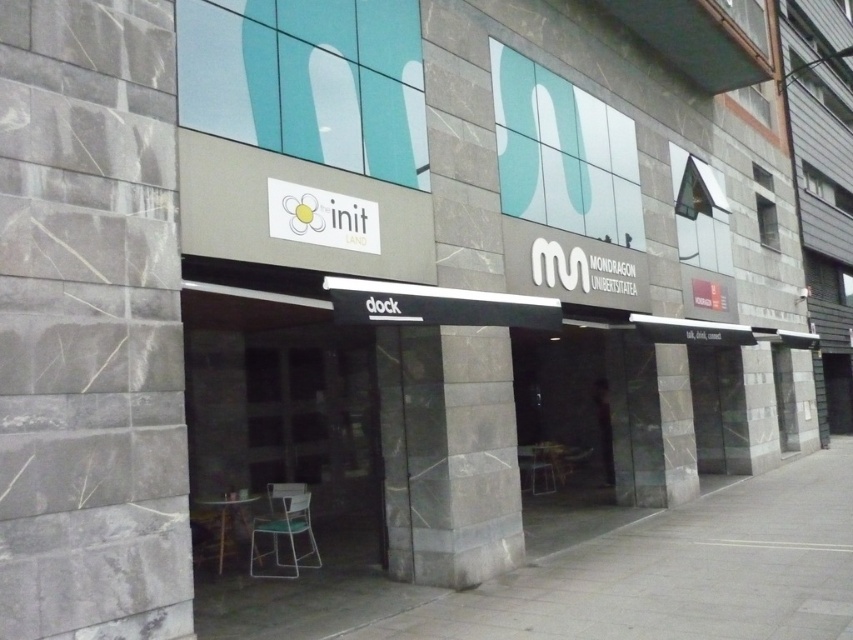
You are standing in front of the modern building with the init LAND sign. You need to enter the building through the matte black door at center. What are the coordinates of the door?

The coordinates of the matte black door at center are point (282, 419).

You are standing at the entrance of the init LAND building and need to find the matte black door at center. Looking down, you notice the gray concrete pavement at lower center. Which object is lower in height?

The gray concrete pavement at lower center is not as tall as the matte black door at center, so the gray concrete pavement at lower center is lower in height.

You are a delivery person trying to enter the building through the matte black door at center. You have a large package that is 2 meters tall. Will the metallic green chair at lower center block your path when you go through the door?

The matte black door at center has a greater height compared to metallic green chair at lower center. Since the door is taller than the chair, the metallic green chair at lower center will not block the path when entering through the matte black door at center.